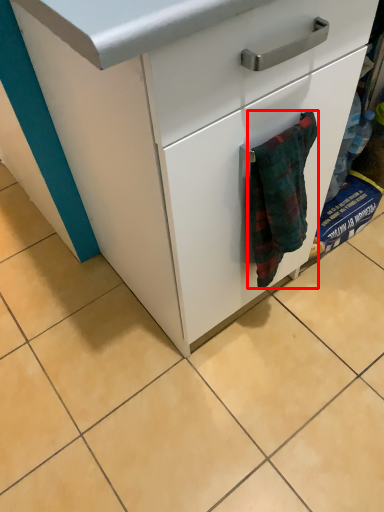
Question: From the image's perspective, where is bath towel (annotated by the red box) located in relation to chest of drawers in the image?

Choices:
 (A) below
 (B) above

Answer: (A)